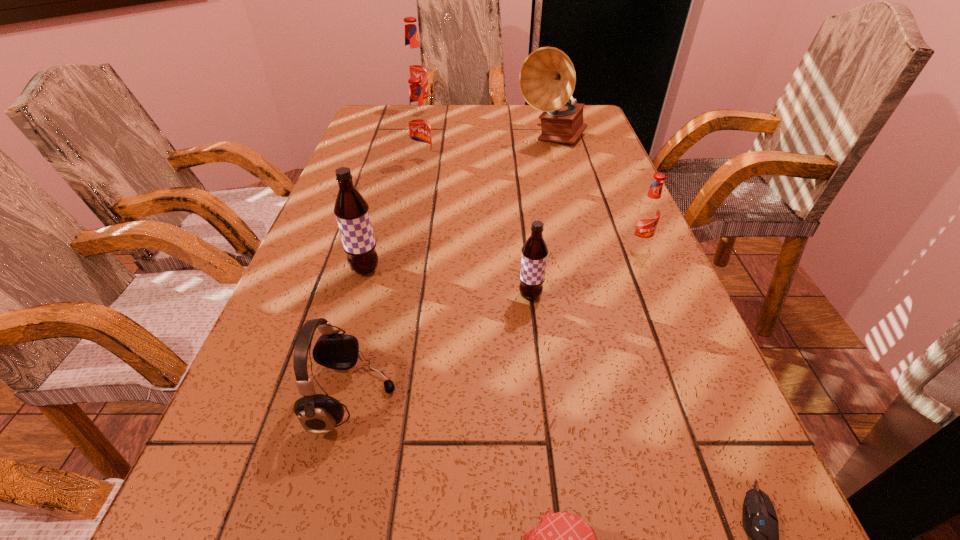
Locate an element on the screen. the fourth farthest object is located at coordinates (648, 213).

Where is `the third nearest object`? the third nearest object is located at coordinates (318, 414).

Where is `vacant space located 0.180m on the right of the tallest root beer`? The image size is (960, 540). vacant space located 0.180m on the right of the tallest root beer is located at coordinates (481, 112).

Where is `free location located 0.150m on the horn of the phonograph record`? The height and width of the screenshot is (540, 960). free location located 0.150m on the horn of the phonograph record is located at coordinates (563, 183).

Locate an element on the screen. free space located 0.140m on the left of the third farthest object is located at coordinates (364, 163).

You are a GUI agent. You are given a task and a screenshot of the screen. Output one action in this format:
    pyautogui.click(x=<x>, y=<y>)
    Task: Click on the free space located on the left of the farther brown root beer
    The height and width of the screenshot is (540, 960).
    Given the screenshot: What is the action you would take?
    pyautogui.click(x=295, y=269)

You are a GUI agent. You are given a task and a screenshot of the screen. Output one action in this format:
    pyautogui.click(x=<x>, y=<y>)
    Task: Click on the blank area located on the front of the nearest root beer
    Image resolution: width=960 pixels, height=540 pixels.
    Given the screenshot: What is the action you would take?
    pyautogui.click(x=550, y=470)

The height and width of the screenshot is (540, 960). I want to click on vacant area situated 0.090m on the left of the fourth farthest object, so click(589, 244).

Locate an element on the screen. The image size is (960, 540). vacant space situated 0.230m with the microphone on the side of the seventh farthest object is located at coordinates (535, 397).

Where is `root beer that is at the far edge`? This screenshot has height=540, width=960. root beer that is at the far edge is located at coordinates (414, 65).